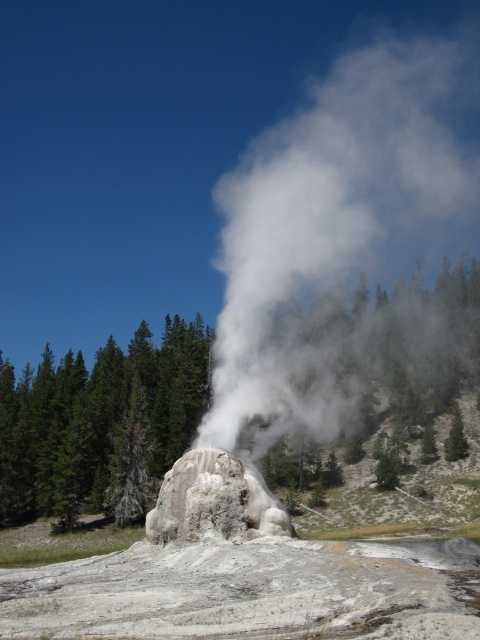
Is the position of white vapor at center more distant than that of gray textured rock at center?

Yes, white vapor at center is behind gray textured rock at center.

Is point (255, 224) in front of point (227, 499)?

That is False.

The image size is (480, 640). Identify the location of white vapor at center. (331, 218).

Who is shorter, white vapor at center or green textured tree at center?

green textured tree at center is shorter.

Which is in front, point (454, 136) or point (442, 384)?

Point (442, 384)

Which is in front, point (419, 86) or point (151, 477)?

Point (151, 477) is more forward.

This screenshot has height=640, width=480. In order to click on white vapor at center in this screenshot , I will do `click(331, 218)`.

Which is behind, point (98, 365) or point (225, 493)?

Point (98, 365)

Consider the image. Is green textured tree at center further to the viewer compared to gray textured rock at center?

Yes, it is.

Is point (387, 390) closer to camera compared to point (200, 509)?

No, it is behind (200, 509).

I want to click on green textured tree at center, so click(99, 426).